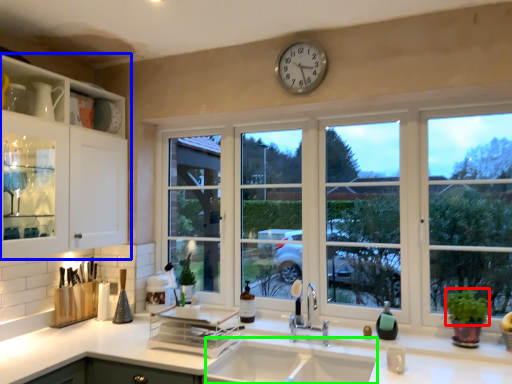
Question: Which is nearer to the plant (highlighted by a red box)? cabinetry (highlighted by a blue box) or sink (highlighted by a green box).

Choices:
 (A) cabinetry
 (B) sink

Answer: (B)